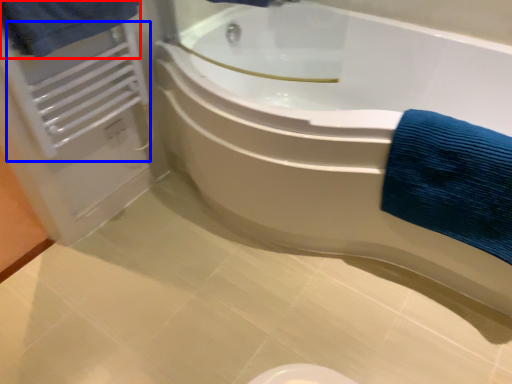
Question: Among these objects, which one is nearest to the camera, bath towel (highlighted by a red box) or radiator (highlighted by a blue box)?

Choices:
 (A) bath towel
 (B) radiator

Answer: (A)